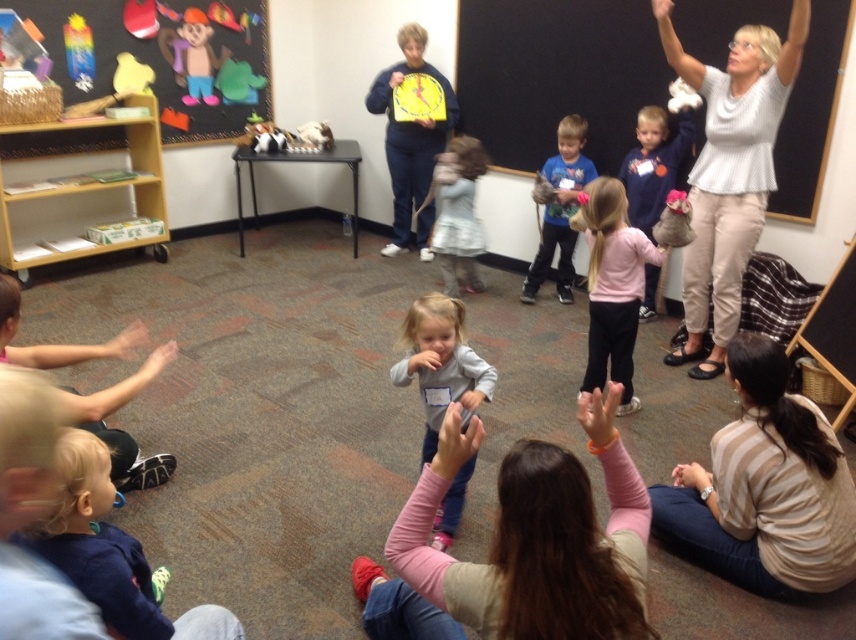
Consider the image. Can you confirm if striped sweater at lower right is positioned above pink matte shirt at center?

Actually, striped sweater at lower right is below pink matte shirt at center.

Who is more distant from viewer, (839, 452) or (616, 259)?

Point (616, 259)

In order to click on striped sweater at lower right in this screenshot , I will do `click(764, 486)`.

Can you confirm if blackboard at upper right is smaller than blue cotton shirt at center?

Actually, blackboard at upper right might be larger than blue cotton shirt at center.

Can you confirm if blackboard at upper right is positioned to the left of blue cotton shirt at center?

No, blackboard at upper right is not to the left of blue cotton shirt at center.

Locate an element on the screen. The width and height of the screenshot is (856, 640). blackboard at upper right is located at coordinates (556, 74).

Is matte cardboard shelf at upper left thinner than white textured blouse at upper right?

No.

Can you confirm if matte cardboard shelf at upper left is taller than white textured blouse at upper right?

No, matte cardboard shelf at upper left is not taller than white textured blouse at upper right.

Between point (68, 38) and point (684, 262), which one is positioned in front?

Point (684, 262)

Locate an element on the screen. The height and width of the screenshot is (640, 856). matte cardboard shelf at upper left is located at coordinates (162, 56).